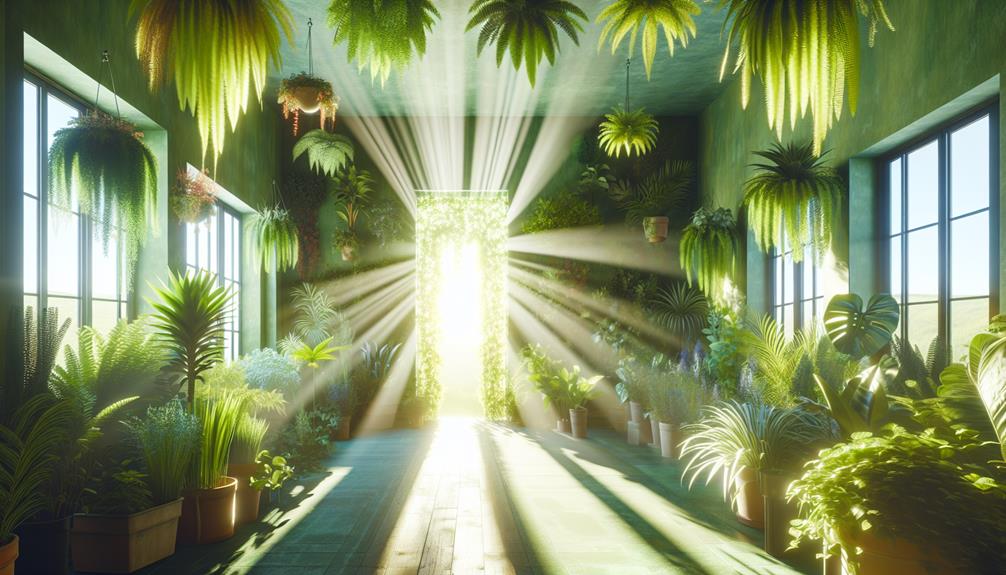
At what (x,y) coordinates should I click in order to perform the action: click on window. Please return your answer as a coordinate pair (x, y). Looking at the image, I should click on (86, 264), (220, 266), (790, 285), (928, 256).